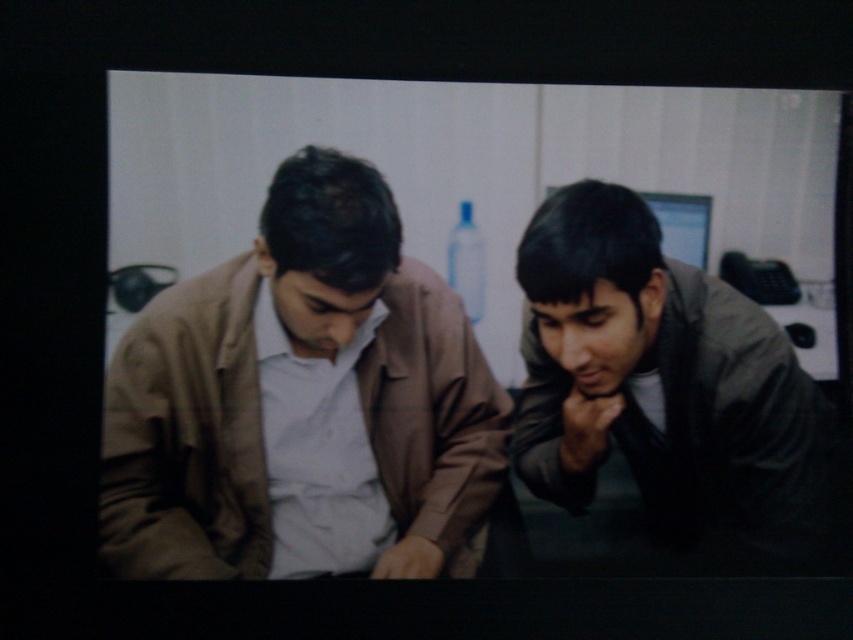
You are organizing a clothing donation drive and need to stack jackets vertically in a narrow closet. Given the space constraints, you must determine which jacket, the matte brown jacket at left or the dark gray jacket at right, can be placed on top without exceeding the closet height limit. Which jacket should you choose?

The matte brown jacket at left has a greater height compared to the dark gray jacket at right, so placing the shorter dark gray jacket at right on top would prevent exceeding the closet height limit.

You are organizing a charity clothing drive and need to categorize jackets by size. Given the two jackets in the scene, the matte brown jacket at left and the dark gray jacket at right, which one should you place in the large size bin?

A: The matte brown jacket at left should be placed in the large size bin since it has a larger size compared to the dark gray jacket at right.